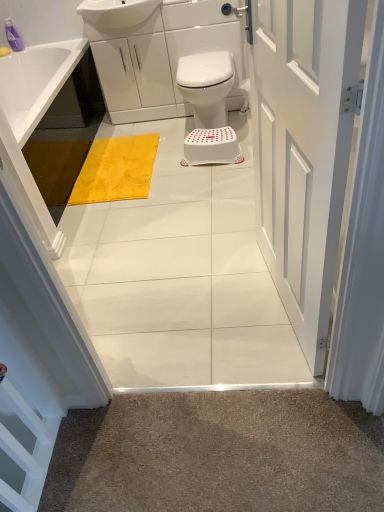
Find the location of `unoccupied space behind white painted wood door at center`. unoccupied space behind white painted wood door at center is located at coordinates (223, 242).